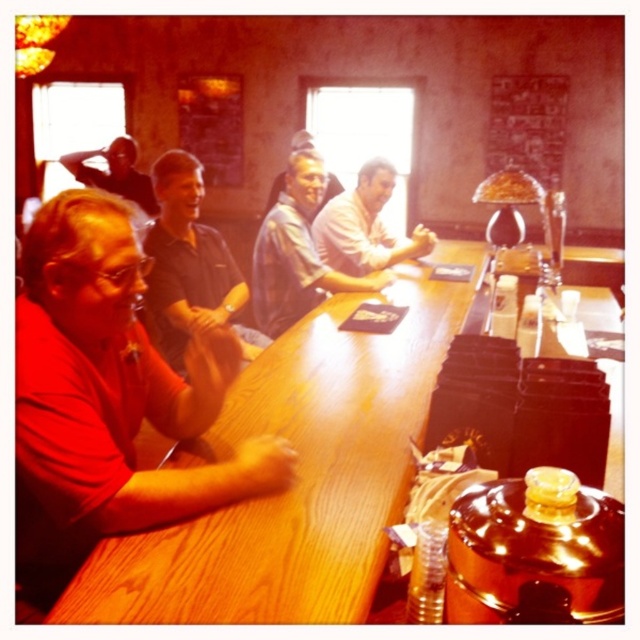
Based on the photo, you are a server at the restaurant and need to deliver a drink to the customer wearing the white matte shirt at center. The drink is currently on the wooden table at center. Which direction should you move the drink to reach the customer?

The wooden table at center is to the left of the white matte shirt at center, so you should move the drink to the right to reach the customer.

You are a server at the restaurant and need to deliver a drink to both the matte red shirt at left and the matte blue shirt at center. Which customer should you approach first if you want to serve the one closer to the front of the bar?

The matte red shirt at left is located below matte blue shirt at center, meaning it is closer to the front of the bar. You should approach the matte red shirt at left first.